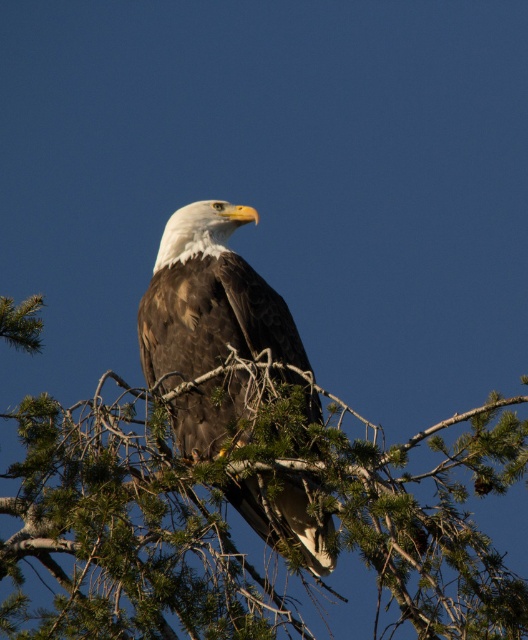
Can you confirm if green needle-like branches at center is wider than brown feathered eagle at center?

Yes.

Can you confirm if green needle-like branches at center is positioned to the left of brown feathered eagle at center?

Yes, green needle-like branches at center is to the left of brown feathered eagle at center.

Between point (306, 480) and point (256, 339), which one is positioned in front?

Positioned in front is point (306, 480).

The width and height of the screenshot is (528, 640). I want to click on green needle-like branches at center, so click(265, 508).